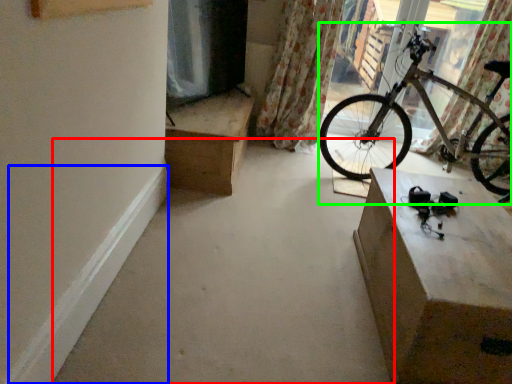
Question: Based on their relative distances, which object is nearer to concrete (highlighted by a red box)? Choose from curb (highlighted by a blue box) and bicycle (highlighted by a green box).

Choices:
 (A) curb
 (B) bicycle

Answer: (A)